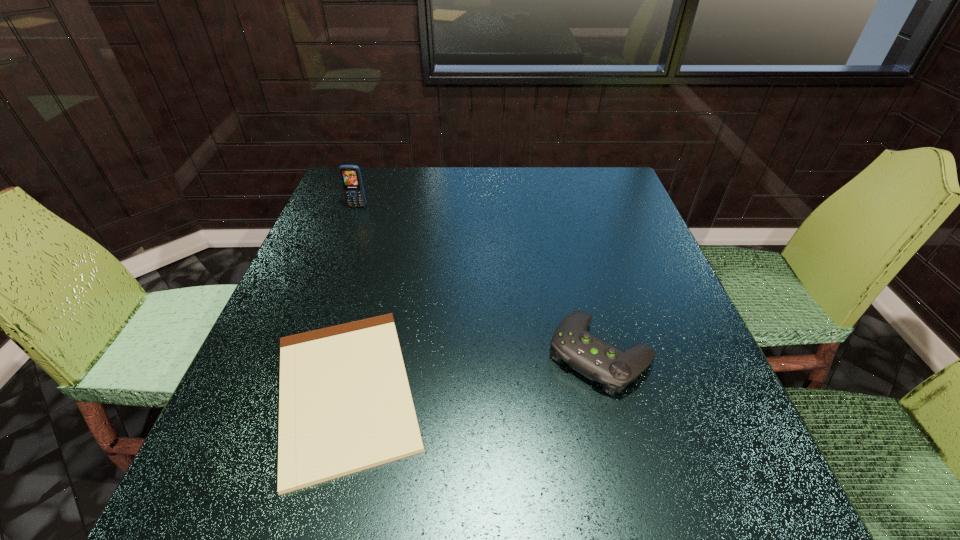
Identify the location of object that is the nearest to the control. (345, 405).

Locate which object is the second closest to the farthest object. Please provide its 2D coordinates. Your answer should be formatted as a tuple, i.e. [(x, y)], where the tuple contains the x and y coordinates of a point satisfying the conditions above.

[(586, 353)]

Where is `vacant space that satisfies the following two spatial constraints: 1. on the screen of the cellular telephone; 2. on the left side of the clipboard`? The image size is (960, 540). vacant space that satisfies the following two spatial constraints: 1. on the screen of the cellular telephone; 2. on the left side of the clipboard is located at coordinates (288, 390).

Identify the location of blank space that satisfies the following two spatial constraints: 1. on the screen of the cellular telephone; 2. on the left side of the control. (301, 354).

Locate an element on the screen. The width and height of the screenshot is (960, 540). free spot that satisfies the following two spatial constraints: 1. on the screen of the clipboard; 2. on the right side of the farthest object is located at coordinates (288, 390).

The width and height of the screenshot is (960, 540). I want to click on free spot that satisfies the following two spatial constraints: 1. on the screen of the clipboard; 2. on the left side of the cellular telephone, so click(288, 390).

At what (x,y) coordinates should I click in order to perform the action: click on free spot that satisfies the following two spatial constraints: 1. on the screen of the second tallest object; 2. on the right side of the farthest object. Please return your answer as a coordinate pair (x, y). The height and width of the screenshot is (540, 960). Looking at the image, I should click on (301, 354).

Identify the location of vacant space that satisfies the following two spatial constraints: 1. on the screen of the tallest object; 2. on the left side of the clipboard. The image size is (960, 540). (288, 390).

Where is `vacant space that satisfies the following two spatial constraints: 1. on the screen of the tallest object; 2. on the left side of the clipboard`? This screenshot has height=540, width=960. vacant space that satisfies the following two spatial constraints: 1. on the screen of the tallest object; 2. on the left side of the clipboard is located at coordinates (288, 390).

Where is `free location that satisfies the following two spatial constraints: 1. on the screen of the control; 2. on the right side of the tallest object`? free location that satisfies the following two spatial constraints: 1. on the screen of the control; 2. on the right side of the tallest object is located at coordinates (301, 354).